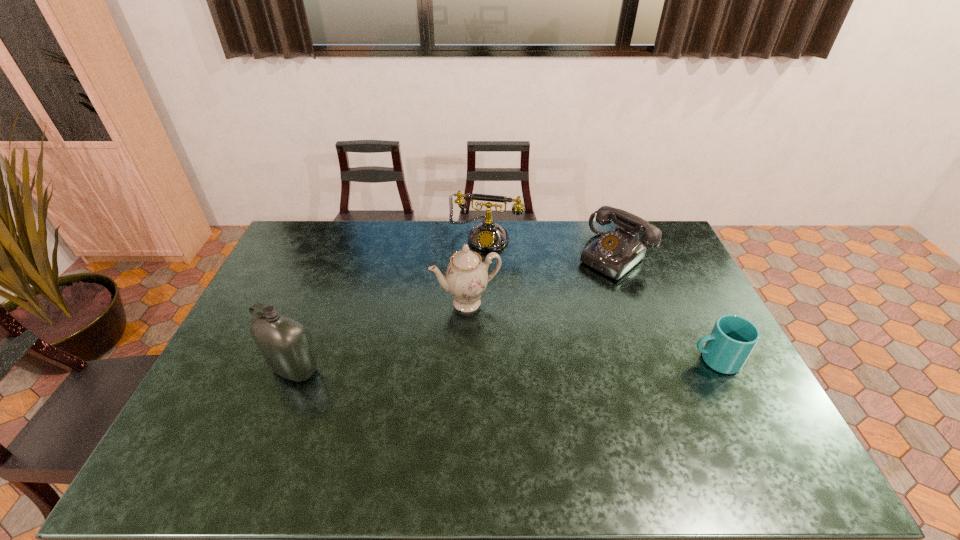
The width and height of the screenshot is (960, 540). I want to click on free spot located on the handle side of the cup, so click(672, 360).

Identify the location of vacant space located 0.240m on the spout of the third nearest object. (503, 377).

Identify the location of vacant space located on the spout of the third nearest object. coord(514,402).

Where is `free space located on the spout of the third nearest object`? The width and height of the screenshot is (960, 540). free space located on the spout of the third nearest object is located at coordinates (486, 338).

This screenshot has height=540, width=960. In order to click on free space located on the dial of the right telephone in this screenshot , I will do pyautogui.click(x=523, y=330).

This screenshot has height=540, width=960. What are the coordinates of `free spot located 0.390m on the dial of the right telephone` in the screenshot? It's located at (518, 334).

The height and width of the screenshot is (540, 960). In order to click on blank area located 0.250m on the dial of the right telephone in this screenshot , I will do `click(548, 310)`.

This screenshot has width=960, height=540. In order to click on free space located on the dial of the left telephone in this screenshot , I will do `click(468, 290)`.

The image size is (960, 540). Find the location of `free space located 0.140m on the dial of the left telephone`. free space located 0.140m on the dial of the left telephone is located at coordinates (472, 276).

Locate an element on the screen. blank area located 0.220m on the dial of the left telephone is located at coordinates (468, 292).